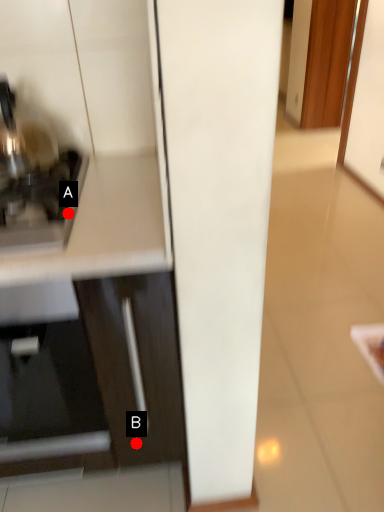
Question: Two points are circled on the image, labeled by A and B beside each circle. Which point is closer to the camera taking this photo?

Choices:
 (A) A is closer
 (B) B is closer

Answer: (A)